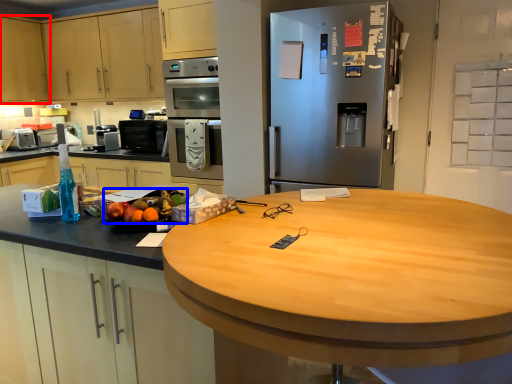
Question: Which object is closer to the camera taking this photo, cabinetry (highlighted by a red box) or fruit (highlighted by a blue box)?

Choices:
 (A) cabinetry
 (B) fruit

Answer: (B)